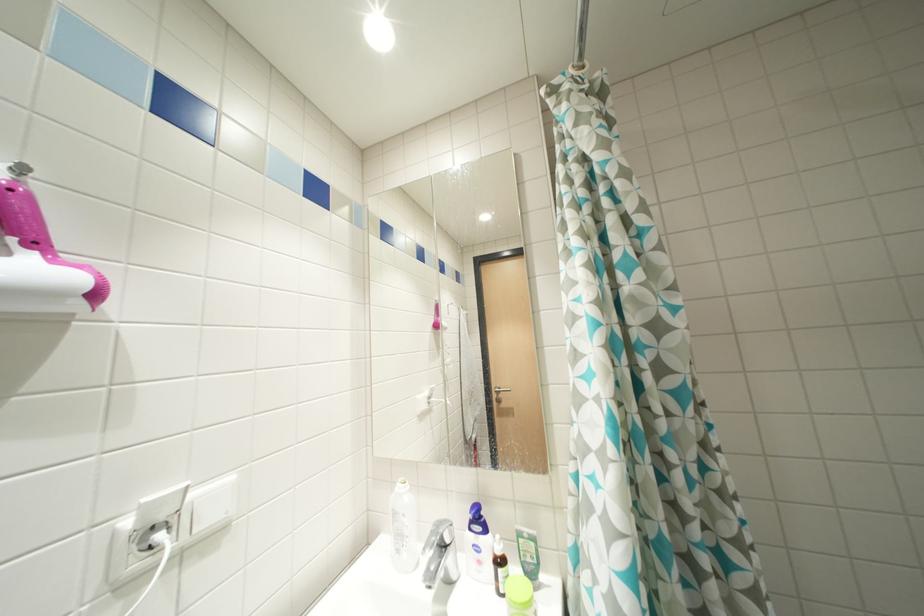
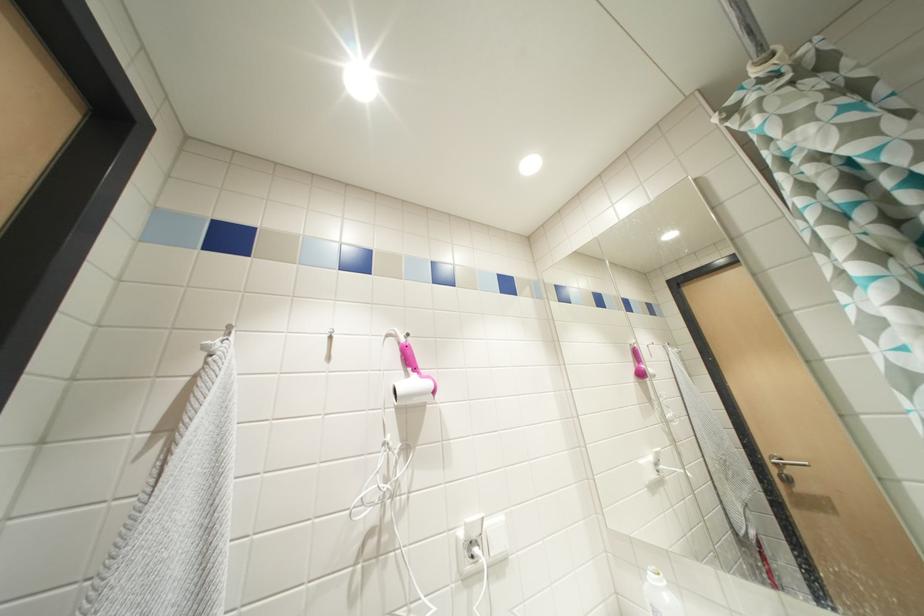
Question: The images are taken continuously from a first-person perspective. In which direction is your viewpoint rotating?

Choices:
 (A) Left
 (B) Right
 (C) Up
 (D) Down

Answer: (A)